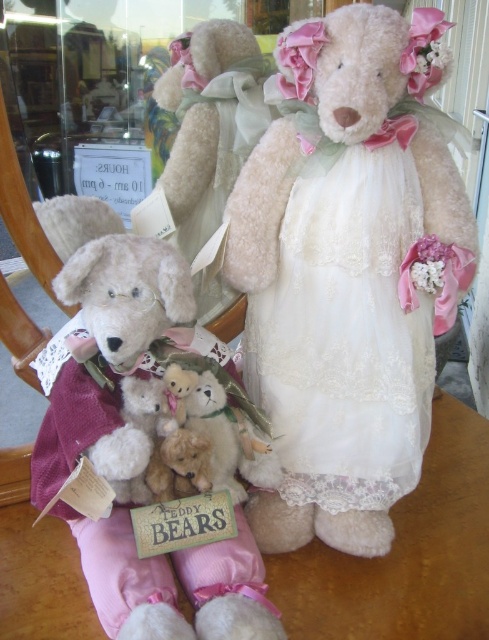
Question: Among these objects, which one is farthest from the camera?

Choices:
 (A) fluffy white teddy bear at lower left
 (B) fluffy white teddy bear at center
 (C) wooden table at center

Answer: (B)

Question: Which of these objects is positioned farthest from the fluffy white teddy bear at center?

Choices:
 (A) fluffy white teddy bear at lower left
 (B) white lace dress at center
 (C) wooden table at center

Answer: (C)

Question: Is the position of white lace dress at center less distant than that of wooden table at center?

Choices:
 (A) yes
 (B) no

Answer: (B)

Question: Which of the following is the farthest from the observer?

Choices:
 (A) (179, 124)
 (B) (357, 573)
 (C) (174, 589)

Answer: (A)

Question: Is white lace dress at center smaller than wooden table at center?

Choices:
 (A) no
 (B) yes

Answer: (B)

Question: Observing the image, what is the correct spatial positioning of white lace dress at center in reference to wooden table at center?

Choices:
 (A) left
 (B) right

Answer: (B)